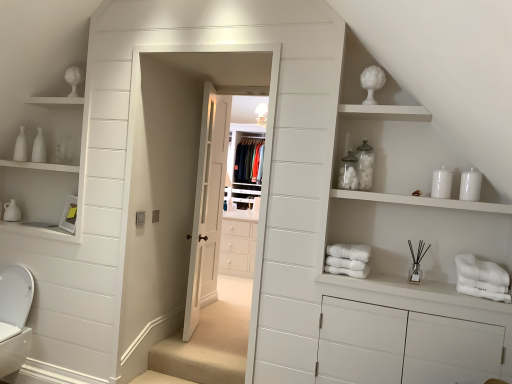
Question: Is white wooden door at center positioned far away from white soft bath towel at center, which is counted as the 1th bath towel, starting from the left?

Choices:
 (A) no
 (B) yes

Answer: (B)

Question: Is white wooden door at center to the left of white soft bath towel at center, which is counted as the 1th bath towel, starting from the left, from the viewer's perspective?

Choices:
 (A) no
 (B) yes

Answer: (B)

Question: From the image's perspective, would you say white wooden door at center is positioned over white soft bath towel at center, which is counted as the 1th bath towel, starting from the left?

Choices:
 (A) yes
 (B) no

Answer: (A)

Question: Is white wooden door at center in front of white soft bath towel at center, which is counted as the 1th bath towel, starting from the left?

Choices:
 (A) no
 (B) yes

Answer: (A)

Question: From a real-world perspective, does white wooden door at center stand above white soft bath towel at center, which ranks as the 2th bath towel in right-to-left order?

Choices:
 (A) yes
 (B) no

Answer: (A)

Question: Is white wooden door at center to the left or to the right of white soft bath towel at center, which is counted as the 1th bath towel, starting from the left, in the image?

Choices:
 (A) right
 (B) left

Answer: (B)

Question: Is white wooden door at center bigger or smaller than white soft bath towel at center, which is counted as the 1th bath towel, starting from the left?

Choices:
 (A) small
 (B) big

Answer: (B)

Question: Considering the positions of point (223, 102) and point (359, 264), is point (223, 102) closer or farther from the camera than point (359, 264)?

Choices:
 (A) farther
 (B) closer

Answer: (A)

Question: From a real-world perspective, is white wooden door at center positioned above or below white soft bath towel at center, which is counted as the 1th bath towel, starting from the left?

Choices:
 (A) above
 (B) below

Answer: (A)

Question: From a real-world perspective, is white matte shelves at upper center above or below white glossy toilet bowl at lower left?

Choices:
 (A) above
 (B) below

Answer: (A)

Question: From the image's perspective, is white matte shelves at upper center positioned above or below white glossy toilet bowl at lower left?

Choices:
 (A) above
 (B) below

Answer: (A)

Question: Considering the positions of white matte shelves at upper center and white glossy toilet bowl at lower left in the image, is white matte shelves at upper center bigger or smaller than white glossy toilet bowl at lower left?

Choices:
 (A) small
 (B) big

Answer: (B)

Question: Is point (290, 231) positioned closer to the camera than point (15, 342)?

Choices:
 (A) farther
 (B) closer

Answer: (B)

Question: From the image's perspective, relative to white cotton bath towel at lower right, the 1th bath towel positioned from the right, is white soft bath towel at center, which is counted as the 1th bath towel, starting from the left, above or below?

Choices:
 (A) below
 (B) above

Answer: (B)

Question: Considering the positions of white soft bath towel at center, which ranks as the 2th bath towel in right-to-left order, and white cotton bath towel at lower right, which is the 2th bath towel in left-to-right order, in the image, is white soft bath towel at center, which ranks as the 2th bath towel in right-to-left order, wider or thinner than white cotton bath towel at lower right, which is the 2th bath towel in left-to-right order,?

Choices:
 (A) thin
 (B) wide

Answer: (A)